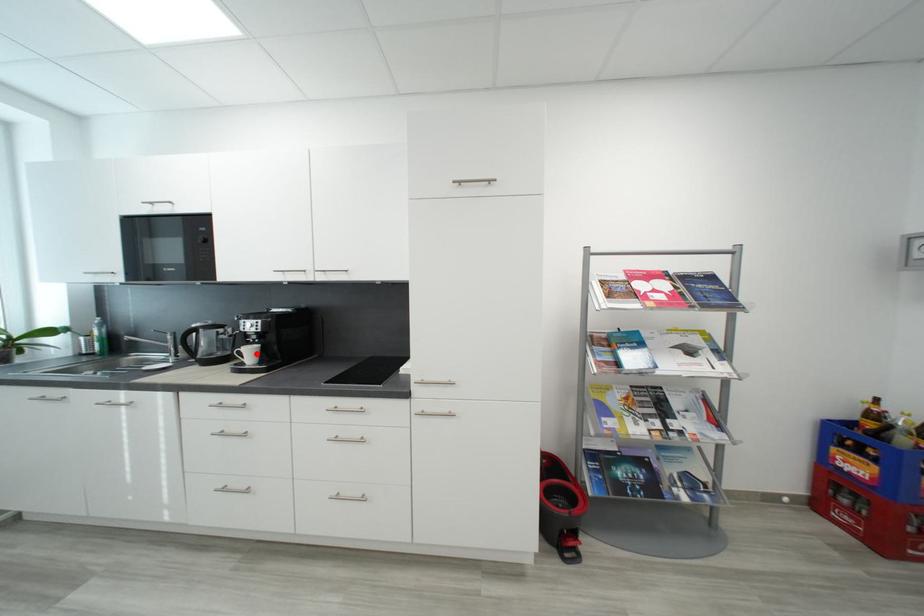
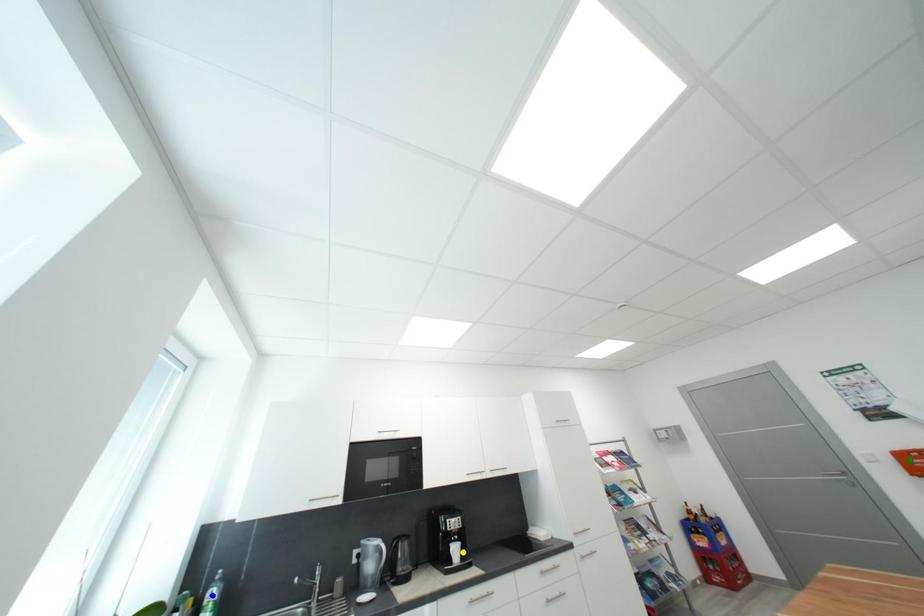
Question: I am providing you with two images of the same scene from different viewpoints. A red point is marked on the first image. You are given multiple points on the second image. Can you choose the point in image 2 that corresponds to the point in image 1?

Choices:
 (A) blue point
 (B) yellow point
 (C) green point

Answer: (B)